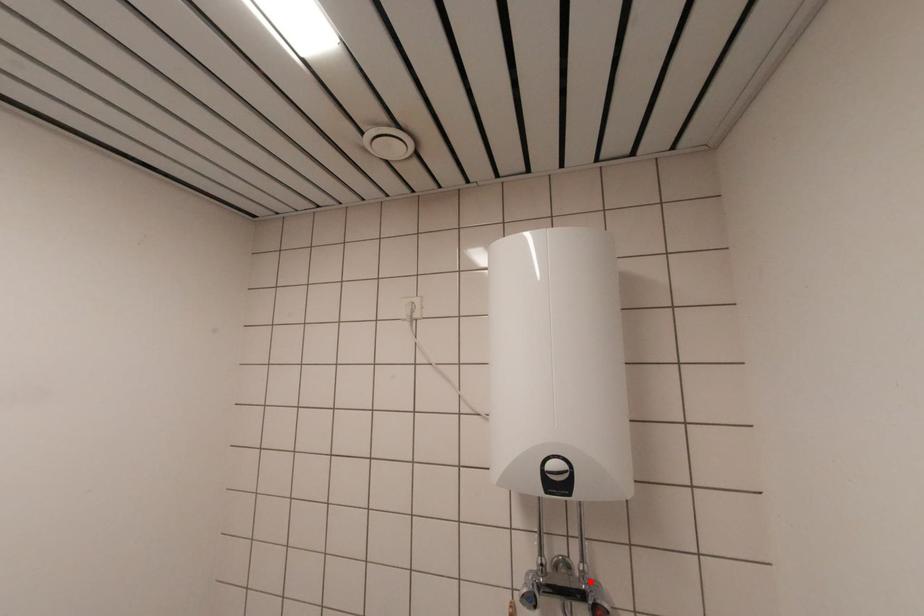
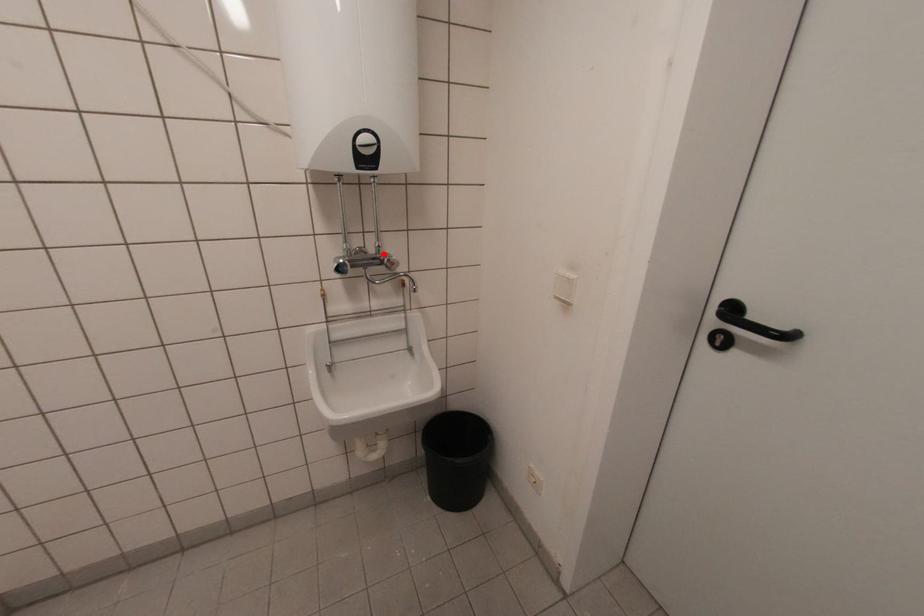
I am providing you with two images of the same scene from different viewpoints. A red point is marked on the first image and another point is marked on the second image. Does the point marked in image1 correspond to the same location as the one in image2?

Yes